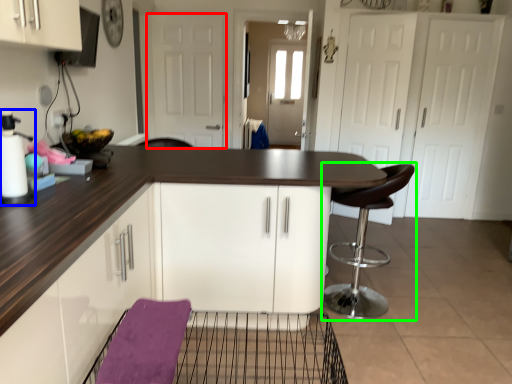
Question: Which is farther away from door (highlighted by a red box)? appliance (highlighted by a blue box) or chair (highlighted by a green box)?

Choices:
 (A) appliance
 (B) chair

Answer: (A)